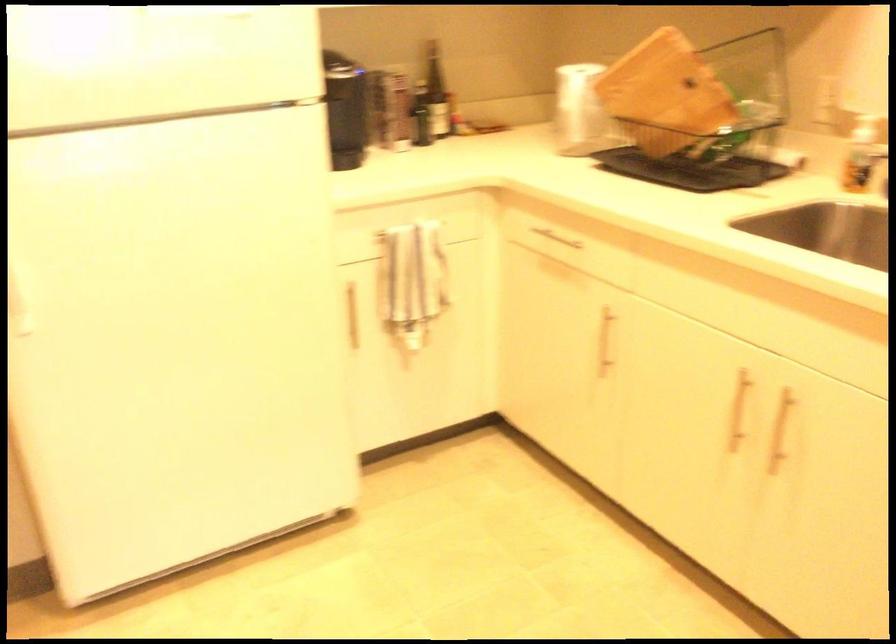
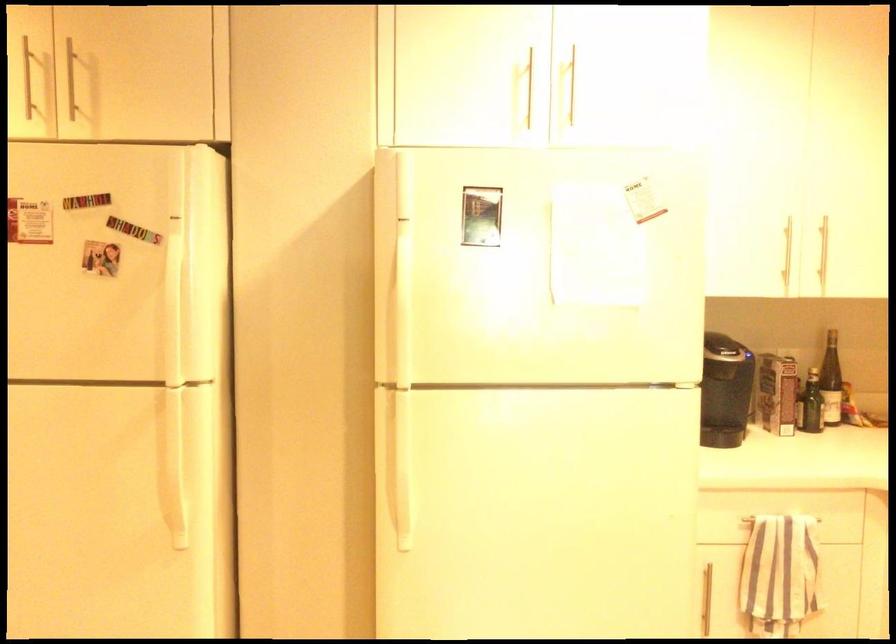
Locate, in the second image, the point that corresponds to the point at 408,223 in the first image.

(781, 518)